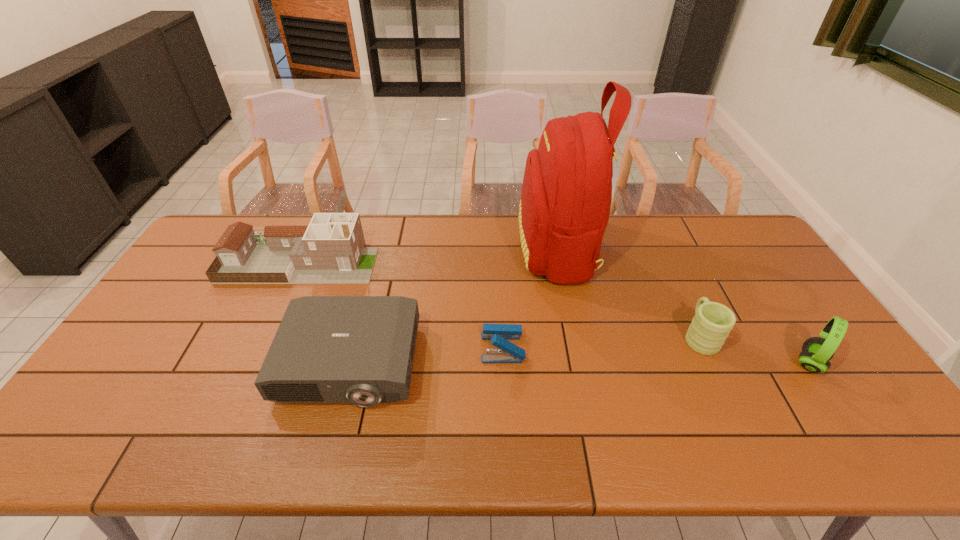
The height and width of the screenshot is (540, 960). Find the location of `object located in the left edge section of the desktop`. object located in the left edge section of the desktop is located at coordinates (330, 250).

You are a GUI agent. You are given a task and a screenshot of the screen. Output one action in this format:
    pyautogui.click(x=<x>, y=<y>)
    Task: Click on the object at the right edge
    
    Given the screenshot: What is the action you would take?
    pyautogui.click(x=816, y=352)

Find the location of a particular element. The width and height of the screenshot is (960, 540). object present at the far left corner is located at coordinates (330, 250).

Where is `vacant space at the far edge`? Image resolution: width=960 pixels, height=540 pixels. vacant space at the far edge is located at coordinates (496, 214).

This screenshot has width=960, height=540. Identify the location of free space at the near edge of the desktop. (406, 441).

This screenshot has width=960, height=540. In the image, there is a desktop. In order to click on free space at the left edge in this screenshot , I will do `click(153, 403)`.

At what (x,y) coordinates should I click in order to perform the action: click on blank space at the right edge of the desktop. Please return your answer as a coordinate pair (x, y). The image size is (960, 540). Looking at the image, I should click on (751, 260).

I want to click on blank space at the far left corner of the desktop, so click(x=253, y=222).

Locate an element on the screen. The width and height of the screenshot is (960, 540). vacant space at the near left corner of the desktop is located at coordinates (90, 427).

Find the location of a particular element. The image size is (960, 540). vacant space in between the second object from right to left and the stapler is located at coordinates (601, 342).